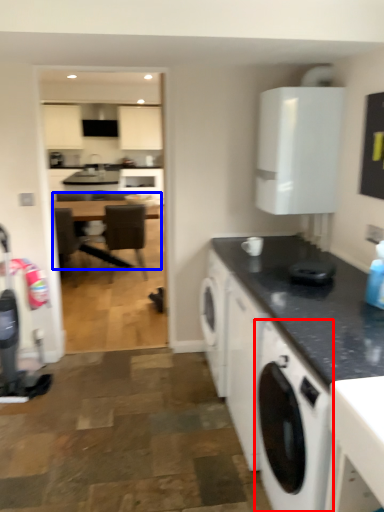
Question: Which object is further to the camera taking this photo, washing machine (highlighted by a red box) or table (highlighted by a blue box)?

Choices:
 (A) washing machine
 (B) table

Answer: (B)